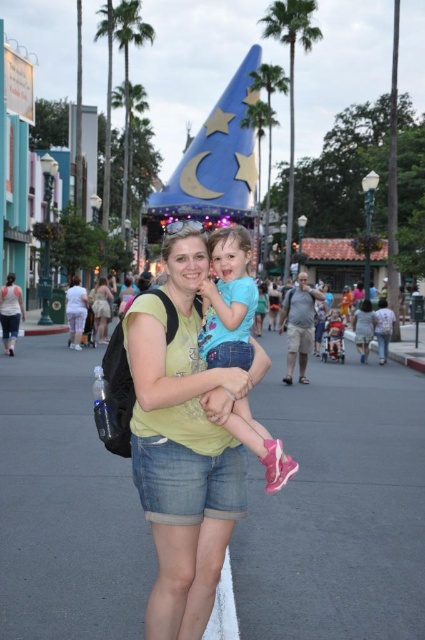
You are a photographer trying to capture a clear shot of both the blue denim shorts at center and the white cotton tank top at lower left. Since you want both items to be visible in your photo, which one should you focus on to ensure the other remains in the background?

You should focus on the blue denim shorts at center because it is in front of the white cotton tank top at lower left, so if you focus on the shorts, the tank top will naturally be in the background and still visible.

You are a theme park guest trying to locate your friend who is wearing a white cotton tank top at lower left and denim shorts at center. Based on the scene description, where should you look relative to the Sorcerer Hat structure?

The white cotton tank top at lower left is above the denim shorts at center, so you should look upwards from the denim shorts at center towards the lower left area near the Sorcerer Hat structure.

You are a photographer trying to capture the iconic Sorcerer Hat in the background while focusing on the woman and girl in the foreground. To ensure both the hat and the subjects are in frame, where should you position the blue denim shorts at center and white cotton tank top at lower left in your shot?

The blue denim shorts at center is positioned under the white cotton tank top at lower left, so you should position the white cotton tank top at lower left higher in the frame and the blue denim shorts at center lower down to include both the Sorcerer Hat in the background and the subjects in the foreground.